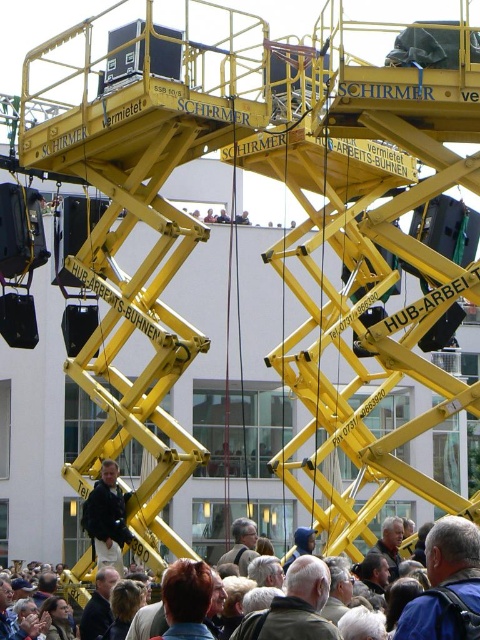
You are standing at the point marked as point (446, 586) in the image. What do you see directly in front of you?

You see the matte black crowd at lower center directly in front of you at point (446, 586).

You are standing in front of the stage structure and want to reach the point at coordinates point (435, 628). Given that the average walking speed is 3 feet per second, how many seconds would it take to reach that point?

The point point (435, 628) is 188.93 feet away from the viewer. At an average walking speed of 3 feet per second, it would take approximately 62.98 seconds to reach that point.